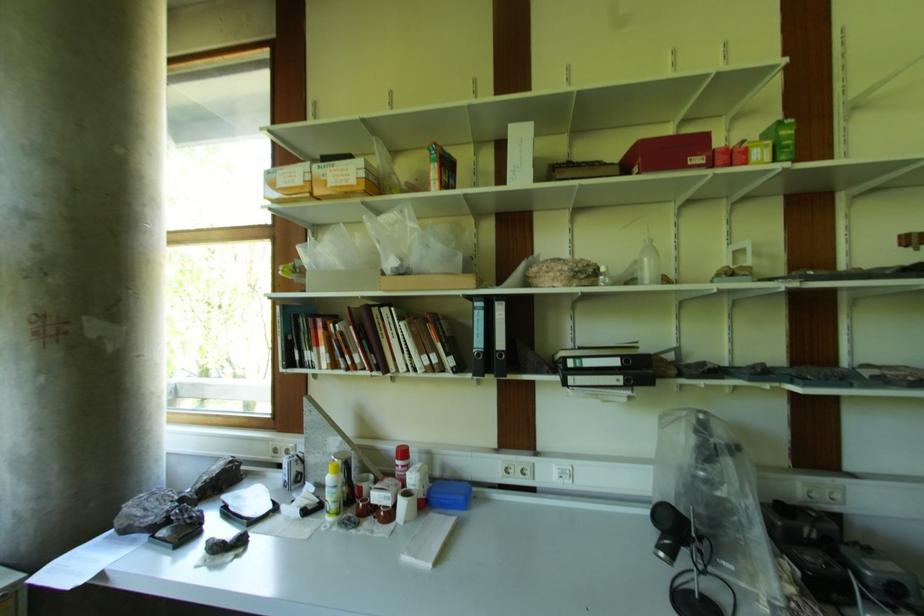
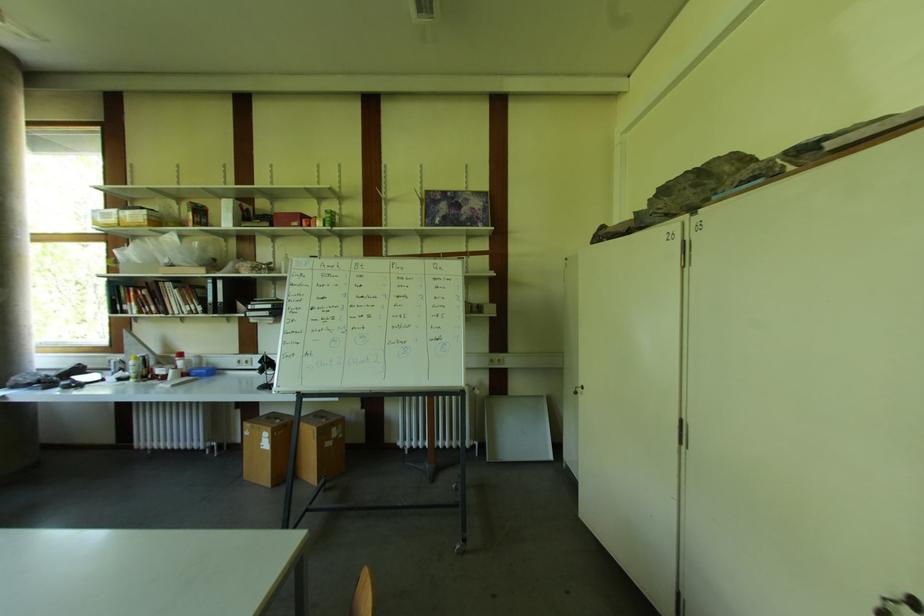
Locate, in the second image, the point that corresponds to [424,498] in the first image.

(188, 373)